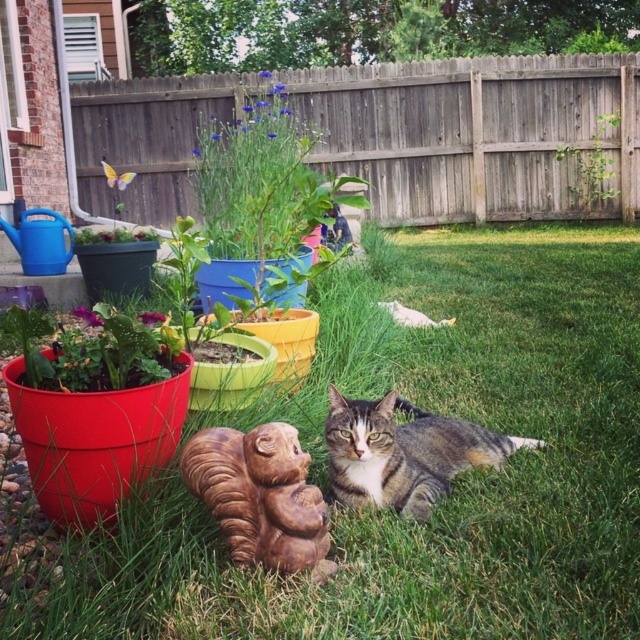
You are planning to install a new sprinkler system in the backyard. The sprinkler has a maximum range of 6 meters. If you place the sprinkler at the wooden fence at upper center, will it be able to water the green grass at center?

The green grass at center is 6.89 meters from wooden fence at upper center. Since the sprinkler has a maximum range of 6 meters, it cannot reach the green grass at center from the wooden fence at upper center.

You are a bird flying at the height of the wooden fence at upper center. Can you see the tabby fur cat at center from your position?

The wooden fence at upper center is much taller than the tabby fur cat at center, so yes, the bird can see the tabby fur cat at center from its position above the fence.

You are a gardener who needs to water the green leafy plant at upper center and the white fur cat at center. You have a watering can that can spray water up to 5 meters. Starting from where you are, can you water both plants without moving closer?

The green leafy plant at upper center is 5.92 meters away from the white fur cat at center. Since the watering can can only spray up to 5 meters, you cannot water both plants without moving closer because the distance between them exceeds the spray range.